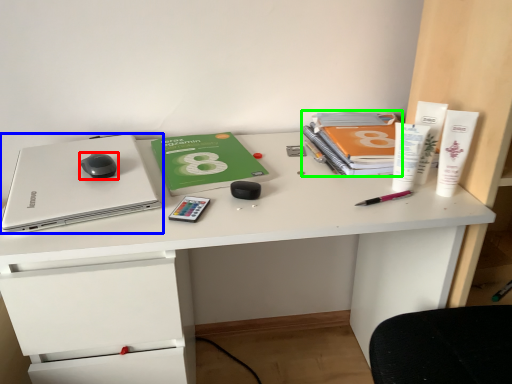
Question: Based on their relative distances, which object is farther from mouse (highlighted by a red box)? Choose from laptop (highlighted by a blue box) and paperback book (highlighted by a green box).

Choices:
 (A) laptop
 (B) paperback book

Answer: (B)